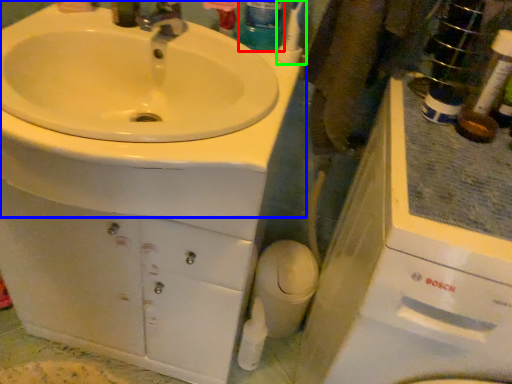
Question: Which object is positioned farthest from mouthwash (highlighted by a red box)? Select from sink (highlighted by a blue box) and toothbrush (highlighted by a green box).

Choices:
 (A) sink
 (B) toothbrush

Answer: (A)